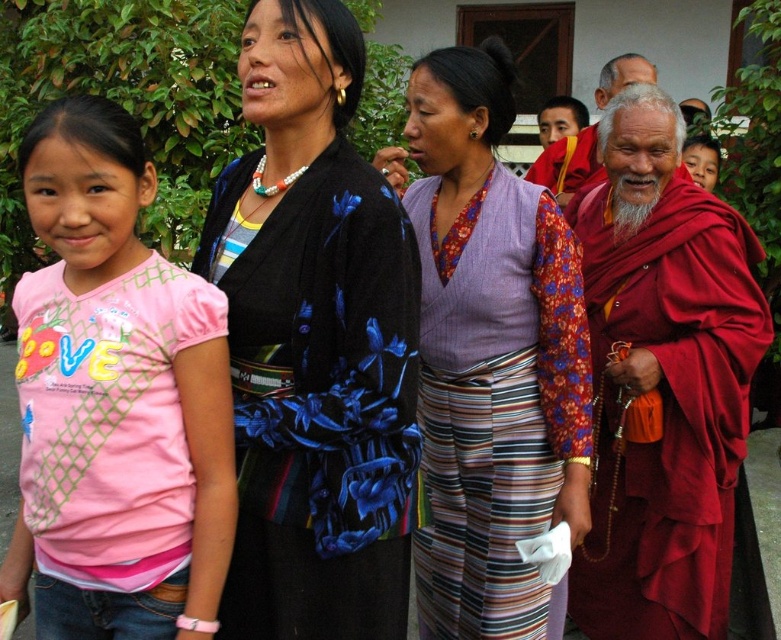
Is pink fabric shirt at left positioned before maroon silk robe at right?

Yes, pink fabric shirt at left is closer to the viewer.

Does pink fabric shirt at left have a greater width compared to maroon silk robe at right?

No, pink fabric shirt at left is not wider than maroon silk robe at right.

Is point (48, 406) farther from viewer compared to point (744, 374)?

No.

You are a GUI agent. You are given a task and a screenshot of the screen. Output one action in this format:
    pyautogui.click(x=<x>, y=<y>)
    Task: Click on the pink fabric shirt at left
    The height and width of the screenshot is (640, 781).
    Given the screenshot: What is the action you would take?
    pyautogui.click(x=122, y=392)

Based on the photo, who is more distant from viewer, (x=141, y=397) or (x=610, y=74)?

Positioned behind is point (x=610, y=74).

Can you confirm if pink fabric shirt at left is positioned above red robe monk at upper right?

Incorrect, pink fabric shirt at left is not positioned above red robe monk at upper right.

In the scene shown: Who is more forward, (180, 476) or (541, 160)?

Point (180, 476)

Locate an element on the screen. The width and height of the screenshot is (781, 640). pink fabric shirt at left is located at coordinates (122, 392).

Can you confirm if maroon silk robe at right is wider than matte purple vest at center?

Yes.

Which of these two, maroon silk robe at right or matte purple vest at center, stands taller?

maroon silk robe at right is taller.

What do you see at coordinates (665, 412) in the screenshot? I see `maroon silk robe at right` at bounding box center [665, 412].

What are the coordinates of `maroon silk robe at right` in the screenshot? It's located at (665, 412).